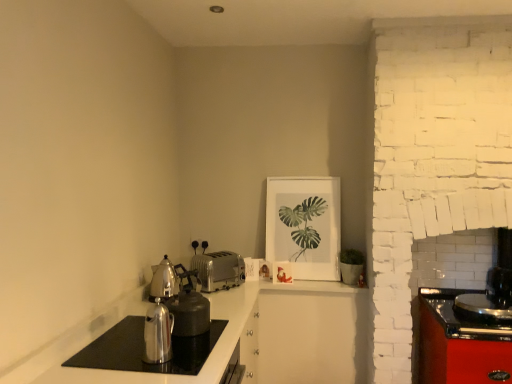
Question: From a real-world perspective, is satin silver teapot at left physically below silver metallic toaster at center?

Choices:
 (A) no
 (B) yes

Answer: (A)

Question: From the image's perspective, is satin silver teapot at left under silver metallic toaster at center?

Choices:
 (A) no
 (B) yes

Answer: (A)

Question: Does satin silver teapot at left have a lesser height compared to silver metallic toaster at center?

Choices:
 (A) no
 (B) yes

Answer: (A)

Question: Is satin silver teapot at left at the right side of silver metallic toaster at center?

Choices:
 (A) yes
 (B) no

Answer: (B)

Question: Does satin silver teapot at left turn towards silver metallic toaster at center?

Choices:
 (A) no
 (B) yes

Answer: (A)

Question: Based on their sizes in the image, would you say silver metallic toaster at center is bigger or smaller than matte white picture frame at upper center?

Choices:
 (A) small
 (B) big

Answer: (A)

Question: Looking at their shapes, would you say silver metallic toaster at center is wider or thinner than matte white picture frame at upper center?

Choices:
 (A) thin
 (B) wide

Answer: (B)

Question: Is silver metallic toaster at center in front of or behind matte white picture frame at upper center in the image?

Choices:
 (A) behind
 (B) front

Answer: (B)

Question: Is silver metallic toaster at center taller or shorter than matte white picture frame at upper center?

Choices:
 (A) tall
 (B) short

Answer: (B)

Question: Considering the relative positions of satin silver teapot at left and shiny metallic kettle at lower left in the image provided, is satin silver teapot at left to the left or to the right of shiny metallic kettle at lower left?

Choices:
 (A) right
 (B) left

Answer: (B)

Question: Is satin silver teapot at left inside or outside of shiny metallic kettle at lower left?

Choices:
 (A) outside
 (B) inside

Answer: (A)

Question: Is point (159, 271) positioned closer to the camera than point (165, 337)?

Choices:
 (A) closer
 (B) farther

Answer: (B)

Question: From their relative heights in the image, would you say satin silver teapot at left is taller or shorter than shiny metallic kettle at lower left?

Choices:
 (A) short
 (B) tall

Answer: (B)

Question: From a real-world perspective, relative to polished silver kettle at lower left, is satin silver teapot at left vertically above or below?

Choices:
 (A) below
 (B) above

Answer: (B)

Question: Considering their positions, is satin silver teapot at left located in front of or behind polished silver kettle at lower left?

Choices:
 (A) front
 (B) behind

Answer: (B)